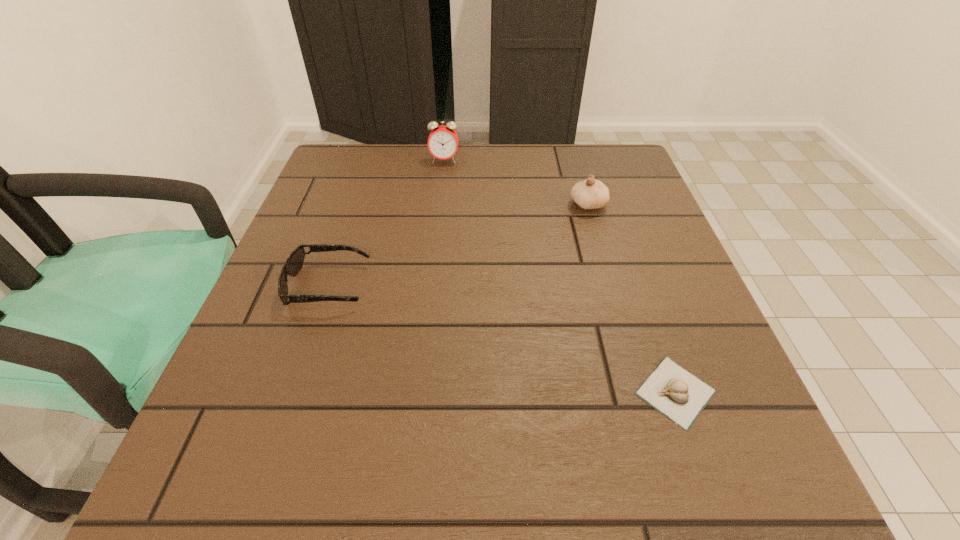
The width and height of the screenshot is (960, 540). In order to click on vacant region that satisfies the following two spatial constraints: 1. on the front-facing side of the farther garlic; 2. on the right side of the farthest object in this screenshot , I will do `click(440, 205)`.

Find the location of a particular element. This screenshot has height=540, width=960. vacant point that satisfies the following two spatial constraints: 1. on the front-facing side of the shorter garlic; 2. on the right side of the leftmost object is located at coordinates (293, 392).

At what (x,y) coordinates should I click in order to perform the action: click on vacant space that satisfies the following two spatial constraints: 1. on the front side of the second tallest object; 2. on the front-facing side of the sunglasses. Please return your answer as a coordinate pair (x, y). The width and height of the screenshot is (960, 540). Looking at the image, I should click on (612, 286).

I want to click on blank area in the image that satisfies the following two spatial constraints: 1. on the front-facing side of the alarm clock; 2. on the front-facing side of the sunglasses, so click(x=431, y=286).